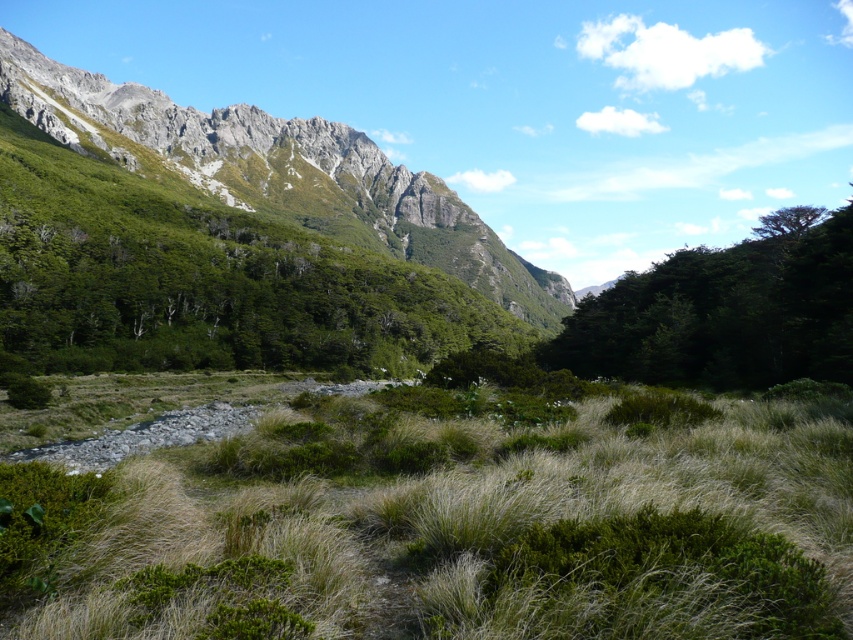
You are standing at the point marked as point (x=474, y=525) in the image. Looking around, you see green grassy at center. What is the immediate terrain under your feet?

The point (x=474, y=525) is on green grassy at center, so the immediate terrain under your feet is green grassy.